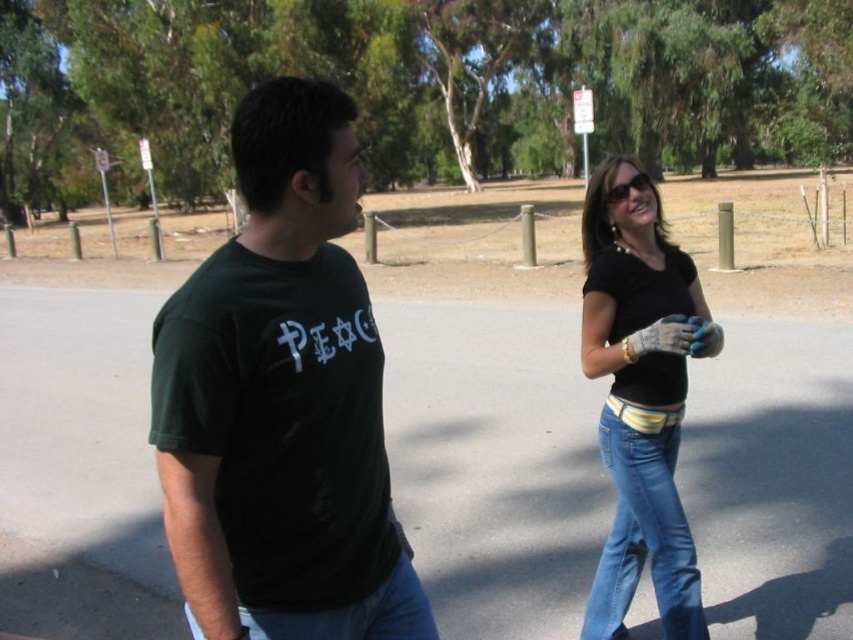
Question: Which of the following is the farthest from the observer?

Choices:
 (A) click(x=277, y=180)
 (B) click(x=300, y=637)
 (C) click(x=608, y=621)

Answer: (C)

Question: Is blue denim jeans at lower right thinner than blue denim jeans at lower left?

Choices:
 (A) yes
 (B) no

Answer: (A)

Question: Does dark green t-shirt at left come behind blue denim jeans at lower right?

Choices:
 (A) no
 (B) yes

Answer: (A)

Question: Does dark green t-shirt at left have a larger size compared to blue denim jeans at lower right?

Choices:
 (A) no
 (B) yes

Answer: (B)

Question: Considering the real-world distances, which object is farthest from the blue denim jeans at lower right?

Choices:
 (A) blue denim jeans at lower left
 (B) black matte shirt at center
 (C) dark green t-shirt at left

Answer: (A)

Question: Which point appears farthest from the camera in this image?

Choices:
 (A) pyautogui.click(x=665, y=236)
 (B) pyautogui.click(x=368, y=611)
 (C) pyautogui.click(x=215, y=541)
 (D) pyautogui.click(x=666, y=451)

Answer: (A)